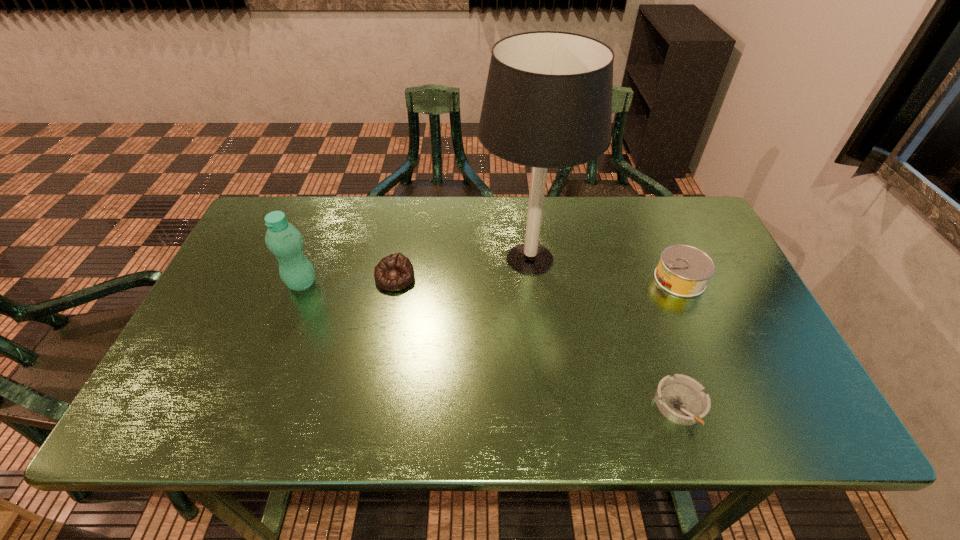
I want to click on empty space that is in between the beanbag and the bottle, so click(x=348, y=280).

This screenshot has height=540, width=960. Identify the location of free spot between the leftmost object and the table lamp. (416, 271).

Identify the location of object that can be found as the closest to the third shortest object. (548, 100).

In order to click on the closest object to the nearest object in this screenshot , I will do `click(683, 270)`.

Find the location of a particular element. This screenshot has height=540, width=960. vacant space that satisfies the following two spatial constraints: 1. on the front side of the ashtray; 2. on the right side of the second object from left to right is located at coordinates (372, 405).

You are a GUI agent. You are given a task and a screenshot of the screen. Output one action in this format:
    pyautogui.click(x=<x>, y=<y>)
    Task: Click on the free spot that satisfies the following two spatial constraints: 1. on the back side of the fourth shortest object; 2. on the right side of the third tallest object
    This screenshot has width=960, height=540.
    Given the screenshot: What is the action you would take?
    pyautogui.click(x=303, y=279)